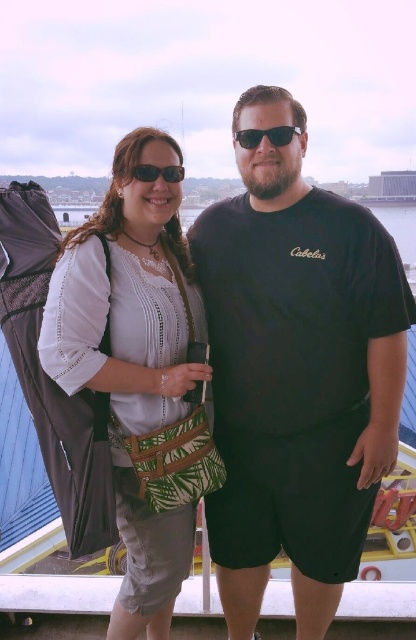
Who is positioned more to the left, green leafy fabric bag at left or matte black sunglasses at upper center?

From the viewer's perspective, green leafy fabric bag at left appears more on the left side.

Is green leafy fabric bag at left further to the viewer compared to matte black sunglasses at upper center?

No, green leafy fabric bag at left is in front of matte black sunglasses at upper center.

Identify the location of green leafy fabric bag at left. [x=128, y=296].

Where is `green leafy fabric bag at left`? The width and height of the screenshot is (416, 640). green leafy fabric bag at left is located at coordinates (128, 296).

Does sunglasses at center appear under matte black sunglasses at upper center?

Incorrect, sunglasses at center is not positioned below matte black sunglasses at upper center.

Does point (240, 138) come in front of point (148, 177)?

No.

The width and height of the screenshot is (416, 640). Identify the location of sunglasses at center. (265, 134).

Is point (401, 324) farther from viewer compared to point (250, 148)?

That is False.

Is black cotton t-shirt at center wider than sunglasses at center?

Yes, black cotton t-shirt at center is wider than sunglasses at center.

Image resolution: width=416 pixels, height=640 pixels. Find the location of `black cotton t-shirt at center`. black cotton t-shirt at center is located at coordinates (297, 372).

Locate an element on the screen. The width and height of the screenshot is (416, 640). black cotton t-shirt at center is located at coordinates (297, 372).